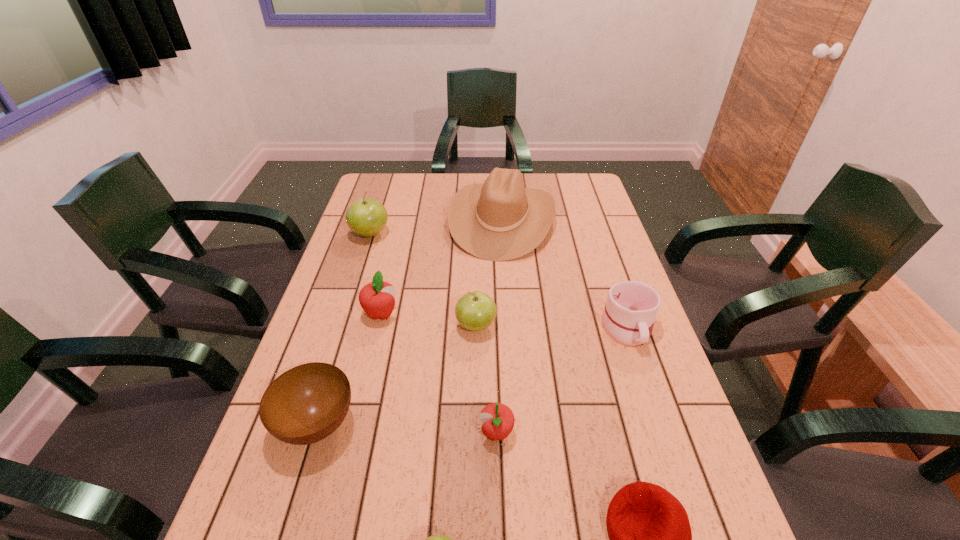
This screenshot has height=540, width=960. I want to click on free spot located on the front of the brown cowboy hat, so click(507, 285).

The width and height of the screenshot is (960, 540). In order to click on free location located 0.220m on the front of the tallest apple in this screenshot , I will do `click(351, 292)`.

Find the location of `free space located 0.280m on the front of the left red apple`. free space located 0.280m on the front of the left red apple is located at coordinates (355, 422).

Where is `vacant space positioned 0.200m on the front of the second farthest green apple`? vacant space positioned 0.200m on the front of the second farthest green apple is located at coordinates (475, 410).

I want to click on free region located 0.080m on the side with the handle of the white mug, so (x=645, y=381).

Where is `blank area located 0.290m on the back of the bowl`? The height and width of the screenshot is (540, 960). blank area located 0.290m on the back of the bowl is located at coordinates (354, 302).

At what (x,y) coordinates should I click in order to perform the action: click on free region located 0.090m on the right of the second nearest apple. Please return your answer as a coordinate pair (x, y). This screenshot has height=540, width=960. Looking at the image, I should click on (556, 433).

Identify the location of object located in the far edge section of the desktop. (499, 220).

You are a GUI agent. You are given a task and a screenshot of the screen. Output one action in this format:
    pyautogui.click(x=<x>, y=<y>)
    Task: Click on the bowl that is at the left edge
    This screenshot has height=540, width=960.
    Given the screenshot: What is the action you would take?
    pyautogui.click(x=307, y=403)

Where is `object that is positioned at the right edge`? The height and width of the screenshot is (540, 960). object that is positioned at the right edge is located at coordinates (628, 317).